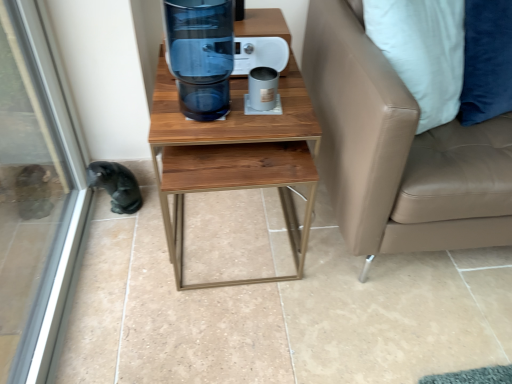
Question: Is tan leather couch at right smaller than transparent glass screen door at lower left?

Choices:
 (A) yes
 (B) no

Answer: (B)

Question: Is tan leather couch at right taller than transparent glass screen door at lower left?

Choices:
 (A) yes
 (B) no

Answer: (B)

Question: From a real-world perspective, is tan leather couch at right over transparent glass screen door at lower left?

Choices:
 (A) yes
 (B) no

Answer: (B)

Question: From a real-world perspective, does tan leather couch at right sit lower than transparent glass screen door at lower left?

Choices:
 (A) no
 (B) yes

Answer: (B)

Question: From the image's perspective, is tan leather couch at right beneath transparent glass screen door at lower left?

Choices:
 (A) no
 (B) yes

Answer: (A)

Question: In the image, is black fur animal at lower left positioned in front of or behind transparent glass water cooler at center?

Choices:
 (A) behind
 (B) front

Answer: (A)

Question: Would you say black fur animal at lower left is to the left or to the right of transparent glass water cooler at center in the picture?

Choices:
 (A) right
 (B) left

Answer: (B)

Question: Would you say black fur animal at lower left is inside or outside transparent glass water cooler at center?

Choices:
 (A) outside
 (B) inside

Answer: (A)

Question: Considering the positions of black fur animal at lower left and transparent glass water cooler at center in the image, is black fur animal at lower left taller or shorter than transparent glass water cooler at center?

Choices:
 (A) short
 (B) tall

Answer: (A)

Question: From the image's perspective, is tan leather couch at right positioned above or below transparent glass water cooler at center?

Choices:
 (A) above
 (B) below

Answer: (B)

Question: In the image, is tan leather couch at right positioned in front of or behind transparent glass water cooler at center?

Choices:
 (A) behind
 (B) front

Answer: (B)

Question: From their relative heights in the image, would you say tan leather couch at right is taller or shorter than transparent glass water cooler at center?

Choices:
 (A) short
 (B) tall

Answer: (B)

Question: Is tan leather couch at right situated inside transparent glass water cooler at center or outside?

Choices:
 (A) outside
 (B) inside

Answer: (A)

Question: Based on their sizes in the image, would you say transparent glass screen door at lower left is bigger or smaller than transparent glass water cooler at center?

Choices:
 (A) small
 (B) big

Answer: (B)

Question: Is transparent glass screen door at lower left situated inside transparent glass water cooler at center or outside?

Choices:
 (A) outside
 (B) inside

Answer: (A)